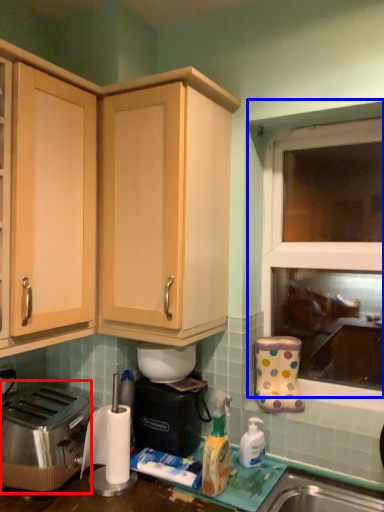
Question: Which point is further to the camera, toaster (highlighted by a red box) or window (highlighted by a blue box)?

Choices:
 (A) toaster
 (B) window

Answer: (B)